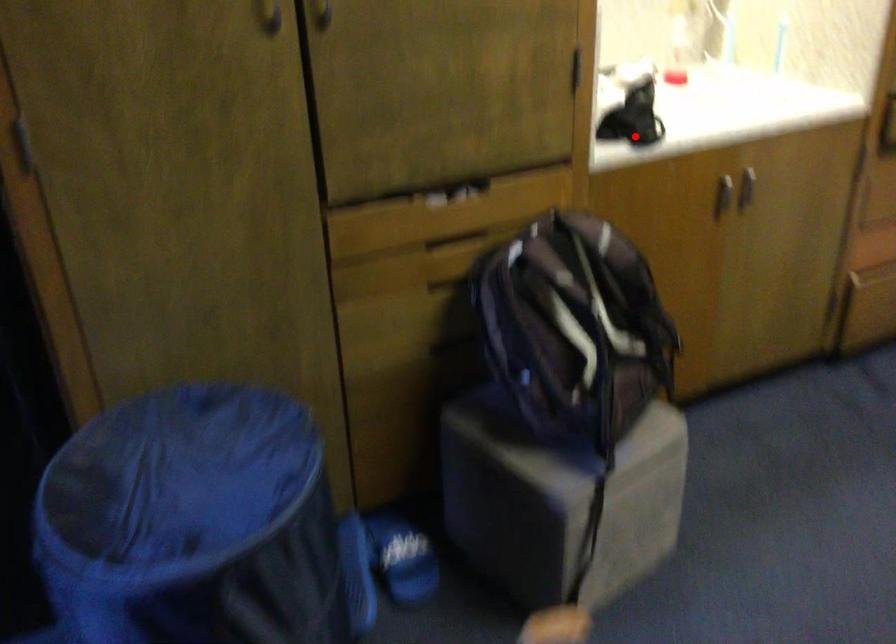
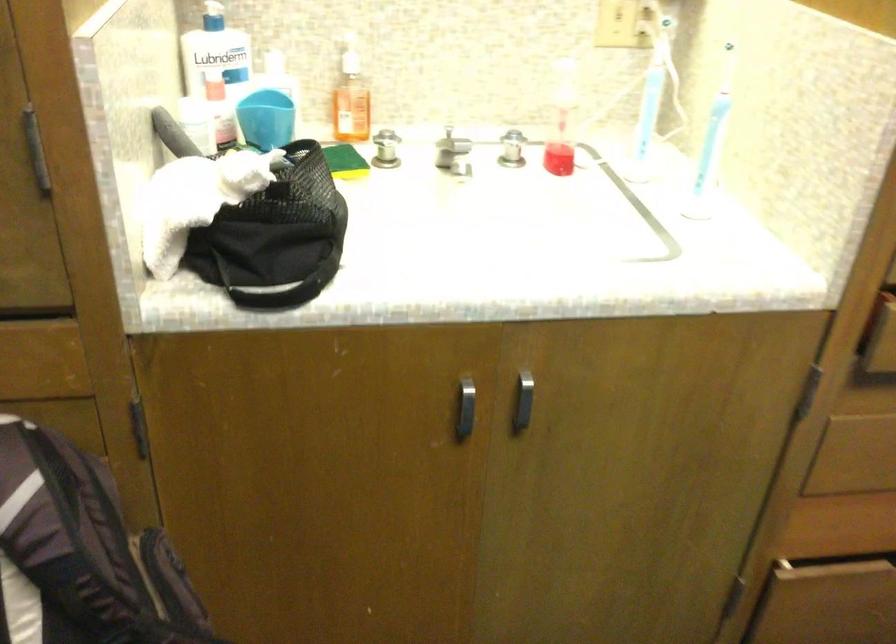
Question: I am providing you with two images of the same scene from different viewpoints. In image1, a red point is highlighted. Considering the same 3D point in image2, which of the following is correct?

Choices:
 (A) It is closer
 (B) It is farther

Answer: (A)